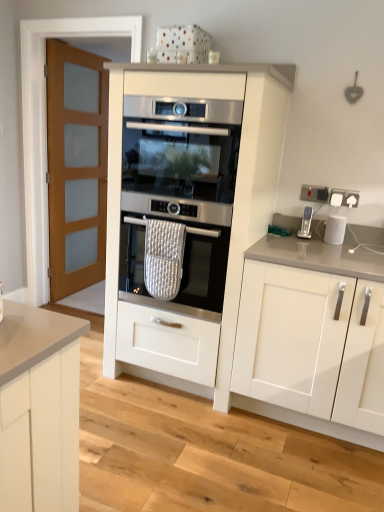
Question: Is white matte cabinet at right, the 1th cabinetry in the right-to-left sequence, facing away from white glossy kettle at upper right?

Choices:
 (A) no
 (B) yes

Answer: (A)

Question: Is white matte cabinet at right, the 1th cabinetry in the right-to-left sequence, at the left side of white glossy kettle at upper right?

Choices:
 (A) no
 (B) yes

Answer: (B)

Question: Is white matte cabinet at right, the 1th cabinetry in the right-to-left sequence, taller than white glossy kettle at upper right?

Choices:
 (A) yes
 (B) no

Answer: (A)

Question: Is white matte cabinet at right, the 1th cabinetry in the right-to-left sequence, closer to camera compared to white glossy kettle at upper right?

Choices:
 (A) no
 (B) yes

Answer: (B)

Question: Could you tell me if white matte cabinet at right, the 1th cabinetry in the right-to-left sequence, is facing white glossy kettle at upper right?

Choices:
 (A) no
 (B) yes

Answer: (A)

Question: Are white matte cabinet at right, the 1th cabinetry in the right-to-left sequence, and white glossy kettle at upper right far apart?

Choices:
 (A) yes
 (B) no

Answer: (B)

Question: Can you see white glossy kettle at upper right touching white matte cabinet at right, the 2th cabinetry from the left?

Choices:
 (A) yes
 (B) no

Answer: (B)

Question: Is white glossy kettle at upper right not within white matte cabinet at right, the 1th cabinetry in the right-to-left sequence?

Choices:
 (A) yes
 (B) no

Answer: (B)

Question: Does white glossy kettle at upper right appear on the right side of white matte cabinet at right, the 2th cabinetry from the left?

Choices:
 (A) yes
 (B) no

Answer: (A)

Question: Considering the relative positions of white glossy kettle at upper right and white matte cabinet at right, the 1th cabinetry in the right-to-left sequence, in the image provided, is white glossy kettle at upper right behind white matte cabinet at right, the 1th cabinetry in the right-to-left sequence,?

Choices:
 (A) no
 (B) yes

Answer: (B)

Question: Considering the relative sizes of white glossy kettle at upper right and white matte cabinet at right, the 2th cabinetry from the left, in the image provided, is white glossy kettle at upper right thinner than white matte cabinet at right, the 2th cabinetry from the left,?

Choices:
 (A) no
 (B) yes

Answer: (B)

Question: From the image's perspective, is white glossy kettle at upper right below white matte cabinet at right, the 2th cabinetry from the left?

Choices:
 (A) yes
 (B) no

Answer: (B)

Question: Does white matte cabinet at right, the 1th cabinetry in the right-to-left sequence, have a lesser width compared to white matte oven at center, which ranks as the 2th cabinetry in right-to-left order?

Choices:
 (A) yes
 (B) no

Answer: (B)